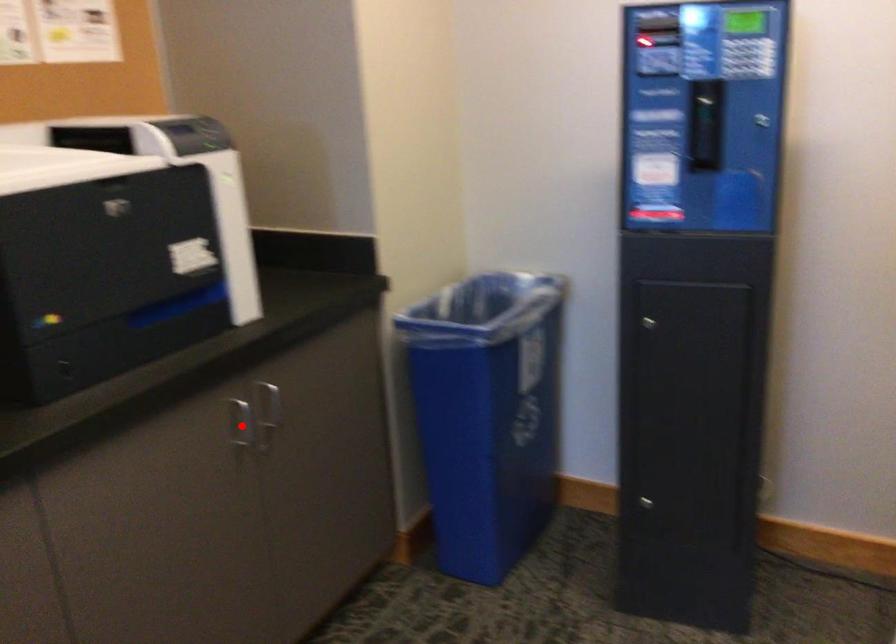
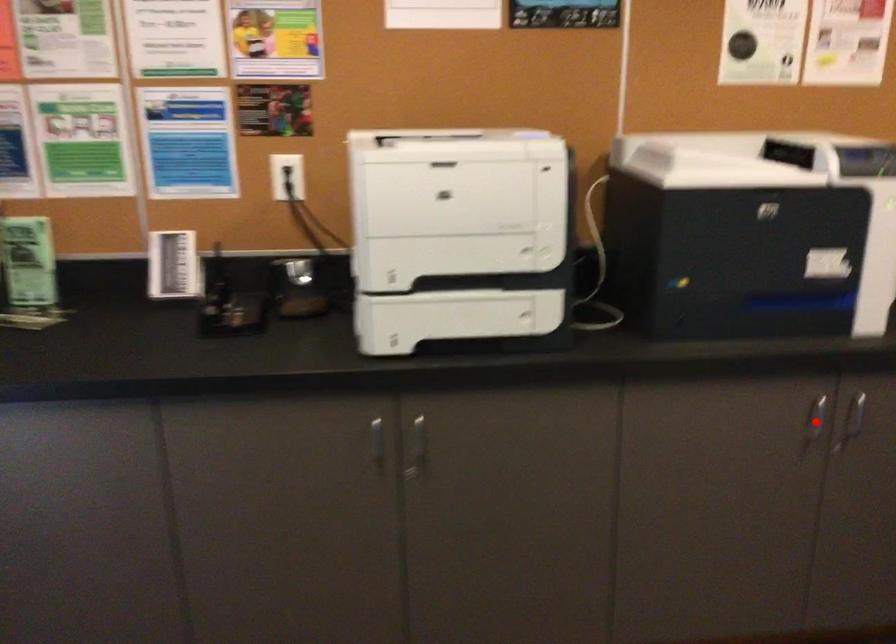
I am providing you with two images of the same scene from different viewpoints. A red point is marked on the first image and another point is marked on the second image. Do the highlighted points in image1 and image2 indicate the same real-world spot?

Yes